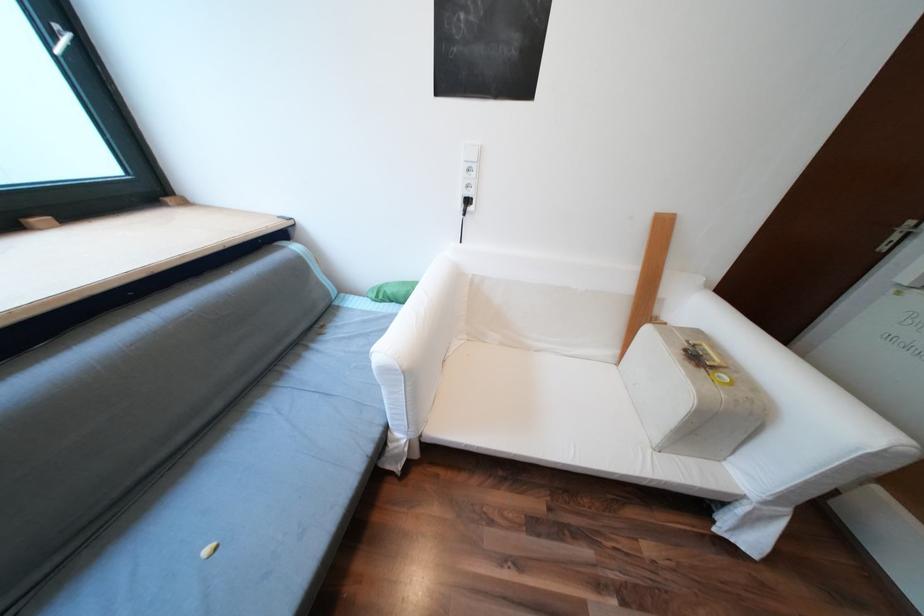
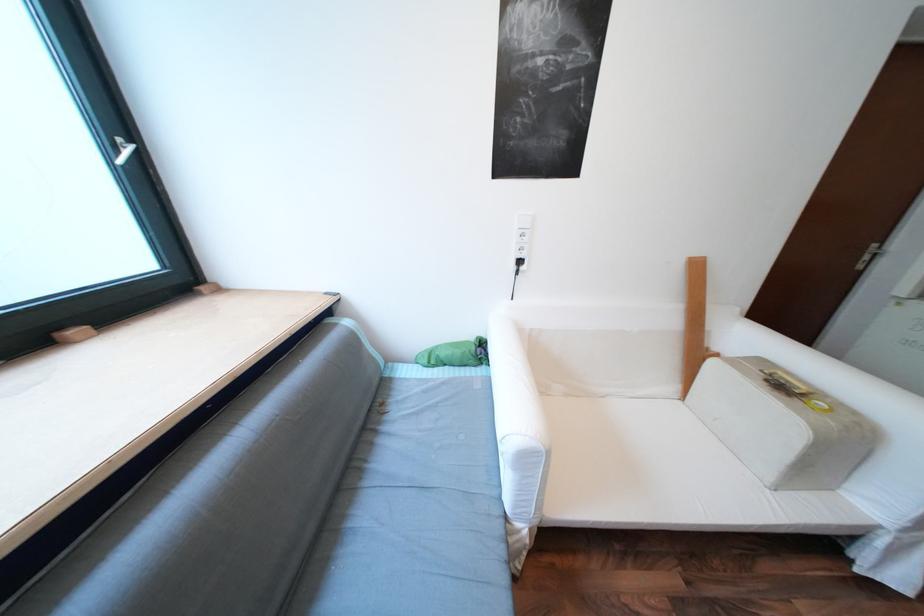
Where in the second image is the point corresponding to pixel 400 301 from the first image?

(455, 365)